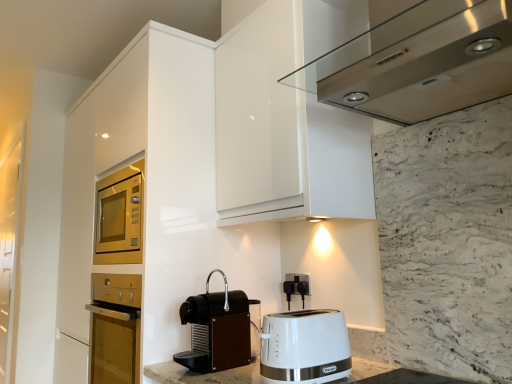
I want to click on satin stainless steel range hood at upper center, so click(418, 62).

This screenshot has width=512, height=384. Describe the element at coordinates (217, 330) in the screenshot. I see `black matte coffee machine at lower center` at that location.

Describe the element at coordinates (9, 244) in the screenshot. I see `transparent glass door at left` at that location.

Identify the location of black plastic outlet at lower center. The height and width of the screenshot is (384, 512). (297, 284).

Measure the distance between black plastic outlet at lower center and camera.

1.68 meters.

The width and height of the screenshot is (512, 384). What are the coordinates of `white plastic toaster at lower center` in the screenshot? It's located at (305, 347).

You are a GUI agent. You are given a task and a screenshot of the screen. Output one action in this format:
    pyautogui.click(x=<x>, y=<y>)
    Task: Click on the electric outlet that appears below the satin stainless steel range hood at upper center (from the image's perspective)
    The image size is (512, 384).
    Given the screenshot: What is the action you would take?
    pyautogui.click(x=297, y=284)

Is satin stainless steel range hood at upper center facing away from black plastic outlet at lower center?

No, satin stainless steel range hood at upper center is not facing the opposite direction of black plastic outlet at lower center.

Which object is positioned more to the left, satin stainless steel range hood at upper center or black plastic outlet at lower center?

From the viewer's perspective, black plastic outlet at lower center appears more on the left side.

Identify the location of toaster below the satin stainless steel range hood at upper center (from a real-world perspective). (305, 347).

Which is correct: satin stainless steel range hood at upper center is inside white plastic toaster at lower center, or outside of it?

satin stainless steel range hood at upper center lies outside white plastic toaster at lower center.

Considering the relative sizes of satin stainless steel range hood at upper center and white plastic toaster at lower center in the image provided, is satin stainless steel range hood at upper center taller than white plastic toaster at lower center?

Yes, satin stainless steel range hood at upper center is taller than white plastic toaster at lower center.

In the scene shown: Who is shorter, black plastic outlet at lower center or satin stainless steel range hood at upper center?

black plastic outlet at lower center is shorter.

Which object is positioned more to the right, black plastic outlet at lower center or satin stainless steel range hood at upper center?

satin stainless steel range hood at upper center is more to the right.

Can you confirm if black plastic outlet at lower center is bigger than satin stainless steel range hood at upper center?

No, black plastic outlet at lower center is not bigger than satin stainless steel range hood at upper center.

Considering the sizes of objects black plastic outlet at lower center and satin stainless steel range hood at upper center in the image provided, who is wider, black plastic outlet at lower center or satin stainless steel range hood at upper center?

satin stainless steel range hood at upper center.

The image size is (512, 384). I want to click on kitchen appliance located below the satin stainless steel range hood at upper center (from the image's perspective), so click(217, 330).

Is black matte coffee machine at lower center positioned beyond the bounds of satin stainless steel range hood at upper center?

Yes, black matte coffee machine at lower center is outside of satin stainless steel range hood at upper center.

Is point (203, 333) positioned in front of point (362, 103)?

No, it is not.

Could you measure the distance between black matte coffee machine at lower center and satin stainless steel range hood at upper center?

black matte coffee machine at lower center is 35.06 inches from satin stainless steel range hood at upper center.

Is black matte coffee machine at lower center taller or shorter than white plastic toaster at lower center?

black matte coffee machine at lower center is taller than white plastic toaster at lower center.

Considering the positions of objects black matte coffee machine at lower center and white plastic toaster at lower center in the image provided, who is more to the right, black matte coffee machine at lower center or white plastic toaster at lower center?

Positioned to the right is white plastic toaster at lower center.

Does black matte coffee machine at lower center have a smaller size compared to white plastic toaster at lower center?

No.

From the image's perspective, between black matte coffee machine at lower center and white plastic toaster at lower center, who is located below?

white plastic toaster at lower center appears lower in the image.

Visually, is white plastic toaster at lower center positioned to the left or to the right of black plastic outlet at lower center?

white plastic toaster at lower center is to the left of black plastic outlet at lower center.

Between white plastic toaster at lower center and black plastic outlet at lower center, which one has more height?

Standing taller between the two is white plastic toaster at lower center.

Is point (277, 333) positioned behind point (298, 287)?

That is False.

In the image, there is a black plastic outlet at lower center. At what (x,y) coordinates should I click in order to perform the action: click on toaster below it (from a real-world perspective). Please return your answer as a coordinate pair (x, y). The image size is (512, 384). Looking at the image, I should click on tap(305, 347).

Considering their positions, is transparent glass door at left located in front of or behind satin stainless steel range hood at upper center?

transparent glass door at left is positioned farther from the viewer than satin stainless steel range hood at upper center.

Considering the sizes of objects transparent glass door at left and satin stainless steel range hood at upper center in the image provided, who is wider, transparent glass door at left or satin stainless steel range hood at upper center?

transparent glass door at left is wider.

This screenshot has height=384, width=512. What are the coordinates of `glass door that is below the satin stainless steel range hood at upper center (from the image's perspective)` in the screenshot? It's located at (9, 244).

From a real-world perspective, which object stands above the other?

satin stainless steel range hood at upper center.

Where is `electric outlet that is behind the satin stainless steel range hood at upper center`? electric outlet that is behind the satin stainless steel range hood at upper center is located at coordinates (297, 284).

Where is `toaster below the satin stainless steel range hood at upper center (from the image's perspective)`? The width and height of the screenshot is (512, 384). toaster below the satin stainless steel range hood at upper center (from the image's perspective) is located at coordinates (305, 347).

Considering their positions, is transparent glass door at left positioned closer to satin stainless steel range hood at upper center than black matte coffee machine at lower center?

black matte coffee machine at lower center is closer to satin stainless steel range hood at upper center.

Looking at this image, when comparing their distances from white plastic toaster at lower center, does satin stainless steel range hood at upper center or black plastic outlet at lower center seem closer?

black plastic outlet at lower center is closer to white plastic toaster at lower center.

Based on their spatial positions, is transparent glass door at left or white plastic toaster at lower center closer to black plastic outlet at lower center?

Among the two, white plastic toaster at lower center is located nearer to black plastic outlet at lower center.

Looking at the image, which one is located further to white plastic toaster at lower center, black matte coffee machine at lower center or black plastic outlet at lower center?

Based on the image, black plastic outlet at lower center appears to be further to white plastic toaster at lower center.

Based on their spatial positions, is black plastic outlet at lower center or black matte coffee machine at lower center closer to transparent glass door at left?

The object closer to transparent glass door at left is black matte coffee machine at lower center.

Based on their spatial positions, is white plastic toaster at lower center or satin stainless steel range hood at upper center further from black matte coffee machine at lower center?

The object further to black matte coffee machine at lower center is satin stainless steel range hood at upper center.

When comparing their distances from transparent glass door at left, does white plastic toaster at lower center or black matte coffee machine at lower center seem closer?

Among the two, black matte coffee machine at lower center is located nearer to transparent glass door at left.

From the image, which object appears to be nearer to black plastic outlet at lower center, white plastic toaster at lower center or satin stainless steel range hood at upper center?

Based on the image, white plastic toaster at lower center appears to be nearer to black plastic outlet at lower center.

Find the location of `electric outlet between satin stainless steel range hood at upper center and white plastic toaster at lower center vertically`. electric outlet between satin stainless steel range hood at upper center and white plastic toaster at lower center vertically is located at coordinates (297, 284).

This screenshot has width=512, height=384. What are the coordinates of `kitchen appliance situated between transparent glass door at left and satin stainless steel range hood at upper center from left to right` in the screenshot? It's located at (217, 330).

Where is `kitchen appliance between white plastic toaster at lower center and black plastic outlet at lower center from front to back`? kitchen appliance between white plastic toaster at lower center and black plastic outlet at lower center from front to back is located at coordinates (217, 330).

Locate an element on the screen. Image resolution: width=512 pixels, height=384 pixels. kitchen appliance between transparent glass door at left and white plastic toaster at lower center is located at coordinates (217, 330).